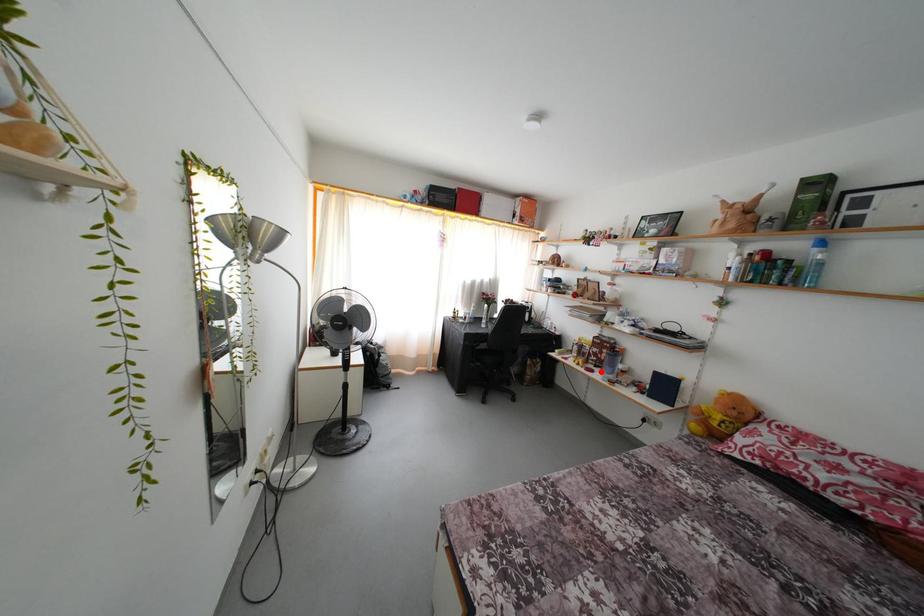
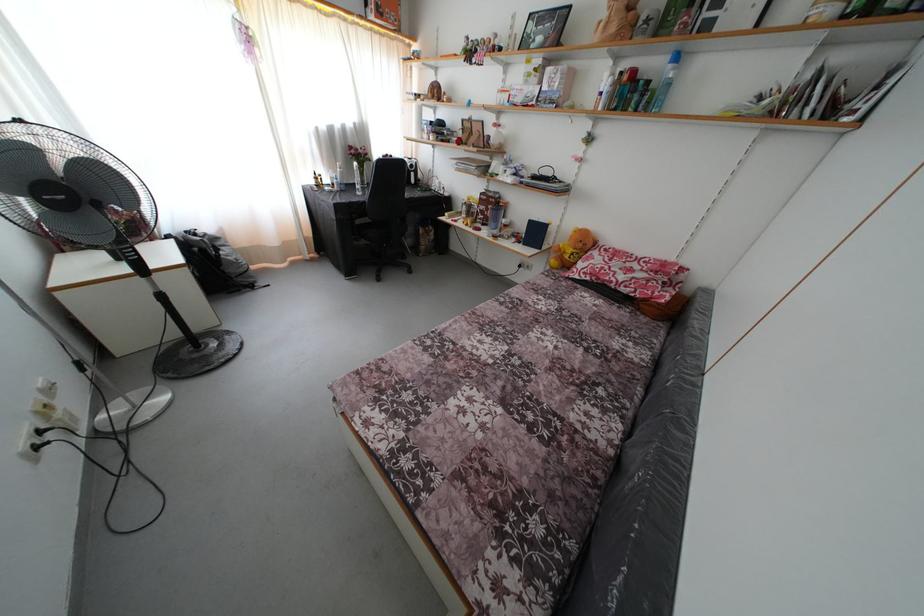
Question: I am providing you with two images of the same scene from different viewpoints. Given a red point in image1, look at the same physical point in image2. Is it:

Choices:
 (A) Closer to the viewpoint
 (B) Farther from the viewpoint

Answer: (A)